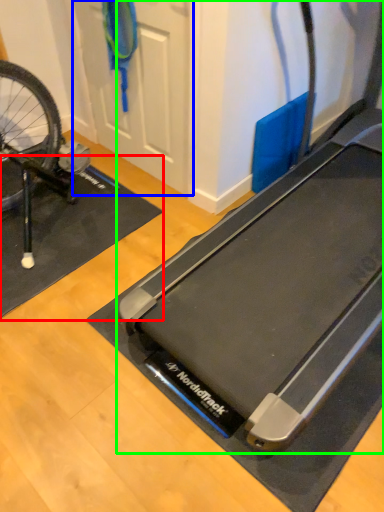
Question: Based on their relative distances, which object is nearer to yoga mat (highlighted by a red box)? Choose from door (highlighted by a blue box) and treadmill (highlighted by a green box).

Choices:
 (A) door
 (B) treadmill

Answer: (A)